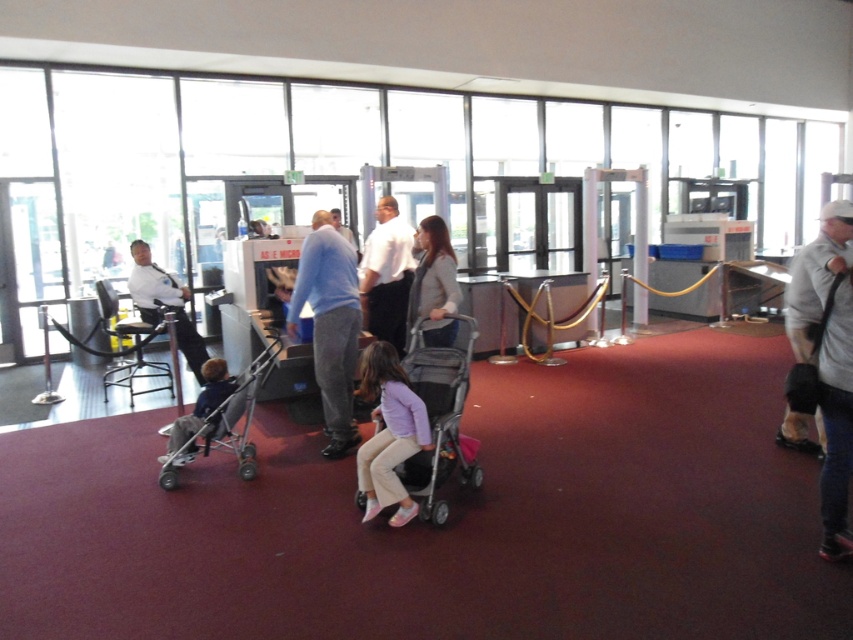
Question: Does pink fabric stroller at center have a smaller size compared to dark blue fabric stroller at lower left?

Choices:
 (A) no
 (B) yes

Answer: (A)

Question: Based on their relative distances, which object is nearer to the dark blue fabric stroller at lower left?

Choices:
 (A) gray fabric jacket at center
 (B) matte black uniform at center
 (C) white shirt at center
 (D) light brown textured jacket at center

Answer: (D)

Question: Does light blue sweater at center appear on the left side of silver metallic stroller at left?

Choices:
 (A) yes
 (B) no

Answer: (B)

Question: Which point is farther to the camera?

Choices:
 (A) matte black uniform at center
 (B) light brown textured jacket at center
 (C) pink fabric stroller at center
 (D) light blue sweater at center

Answer: (A)

Question: Which point is farther to the camera?

Choices:
 (A) silver metallic stroller at left
 (B) white shirt at center
 (C) light blue sweater at center

Answer: (B)

Question: Is pink fabric stroller at center further to the viewer compared to silver metallic stroller at left?

Choices:
 (A) yes
 (B) no

Answer: (B)